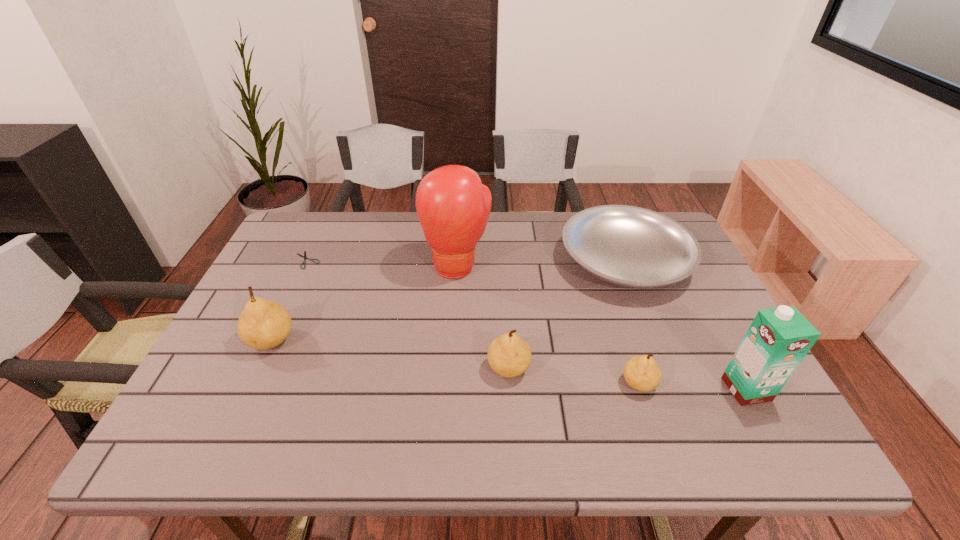
Identify the location of carton at the near edge. (778, 339).

What are the coordinates of `pear that is at the left edge` in the screenshot? It's located at (263, 324).

At what (x,y) coordinates should I click in order to perform the action: click on shears that is at the left edge. Please return your answer as a coordinate pair (x, y). The image size is (960, 540). Looking at the image, I should click on (304, 256).

Where is `bedpan that is at the right edge`? bedpan that is at the right edge is located at coordinates (629, 246).

This screenshot has height=540, width=960. In order to click on carton present at the right edge in this screenshot , I will do `click(778, 339)`.

Identify the location of object situated at the far left corner. The height and width of the screenshot is (540, 960). (304, 256).

The image size is (960, 540). I want to click on object at the far right corner, so click(629, 246).

Image resolution: width=960 pixels, height=540 pixels. In order to click on object positioned at the near right corner in this screenshot , I will do `click(778, 339)`.

Image resolution: width=960 pixels, height=540 pixels. What are the coordinates of `free space at the far edge of the desktop` in the screenshot? It's located at [x=527, y=216].

Find the location of a particular element. Image resolution: width=960 pixels, height=540 pixels. free region at the near edge of the desktop is located at coordinates (266, 404).